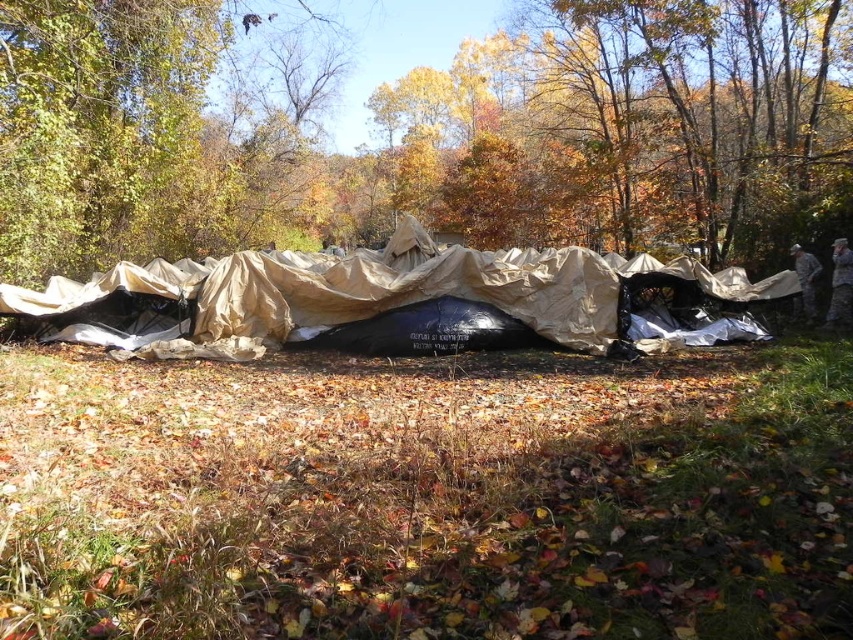
Question: Is brown matte tarp at center further to the viewer compared to tan fabric tent at center?

Choices:
 (A) no
 (B) yes

Answer: (B)

Question: Does brown matte tarp at center have a smaller size compared to tan fabric tent at center?

Choices:
 (A) yes
 (B) no

Answer: (B)

Question: Is brown matte tarp at center to the left of tan fabric tent at center from the viewer's perspective?

Choices:
 (A) no
 (B) yes

Answer: (A)

Question: Among these points, which one is farthest from the camera?

Choices:
 (A) [x=67, y=131]
 (B) [x=186, y=294]

Answer: (A)

Question: Which of the following is the farthest from the observer?

Choices:
 (A) tan fabric tent at center
 (B) brown matte tarp at center

Answer: (B)

Question: Among these objects, which one is farthest from the camera?

Choices:
 (A) tan fabric tent at center
 (B) brown matte tarp at center

Answer: (B)